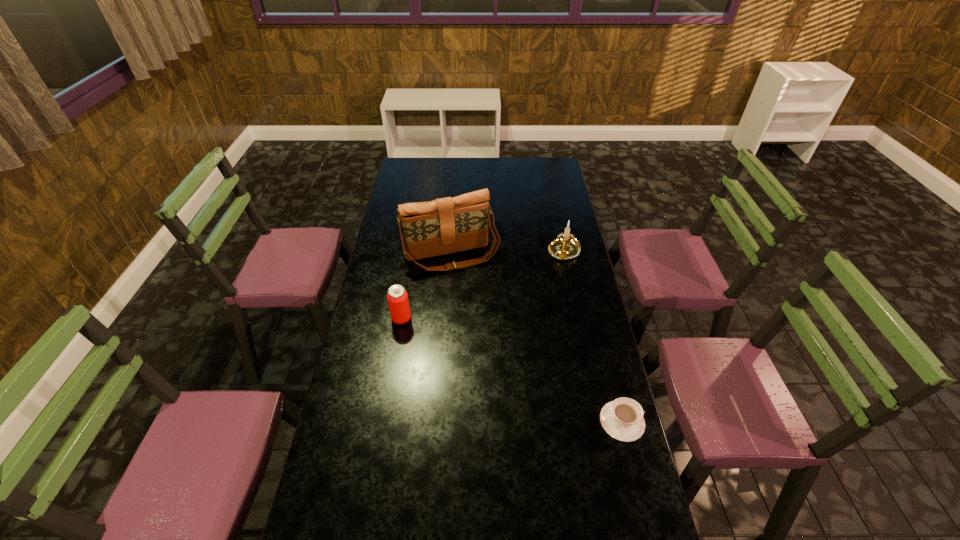
Locate which object ranks third in proximity to the candle holder. Please provide its 2D coordinates. Your answer should be formatted as a tuple, i.e. [(x, y)], where the tuple contains the x and y coordinates of a point satisfying the conditions above.

[(622, 419)]

Where is `object identified as the third closest to the shoulder bag`? object identified as the third closest to the shoulder bag is located at coordinates (622, 419).

The width and height of the screenshot is (960, 540). I want to click on free spot that satisfies the following two spatial constraints: 1. on the back side of the shoulder bag; 2. on the left side of the beer can, so click(412, 255).

At what (x,y) coordinates should I click in order to perform the action: click on vacant space that satisfies the following two spatial constraints: 1. on the front side of the shortest object; 2. on the handle side of the candle holder. Please return your answer as a coordinate pair (x, y). Looking at the image, I should click on (600, 421).